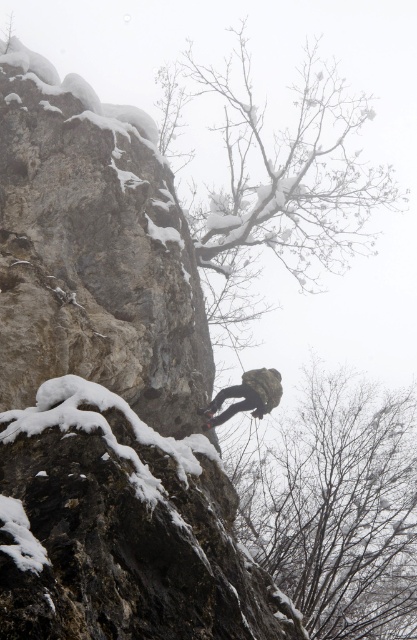
Question: Which object appears farthest from the camera in this image?

Choices:
 (A) camouflage fabric rock climber at center
 (B) snow-covered branches at upper center

Answer: (B)

Question: Which is farther from the snow-covered branches at upper center?

Choices:
 (A) camouflage fabric rock climber at center
 (B) bare branches at center

Answer: (A)

Question: Is snow-covered branches at upper center smaller than camouflage fabric rock climber at center?

Choices:
 (A) no
 (B) yes

Answer: (A)

Question: Does snow-covered branches at upper center appear over camouflage fabric rock climber at center?

Choices:
 (A) yes
 (B) no

Answer: (A)

Question: Estimate the real-world distances between objects in this image. Which object is farther from the bare branches at center?

Choices:
 (A) snow-covered branches at upper center
 (B) camouflage fabric rock climber at center

Answer: (B)

Question: Is the position of bare branches at center less distant than that of camouflage fabric rock climber at center?

Choices:
 (A) no
 (B) yes

Answer: (A)